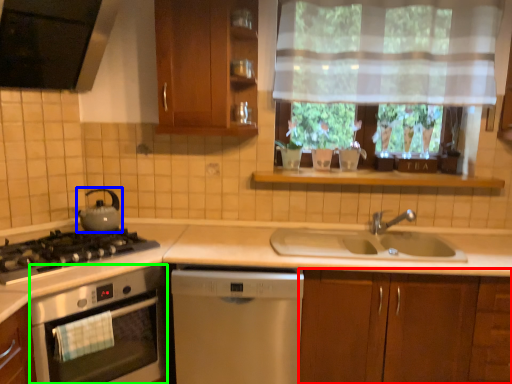
Question: Which is farther away from cabinetry (highlighted by a red box)? kitchen appliance (highlighted by a blue box) or kitchen appliance (highlighted by a green box)?

Choices:
 (A) kitchen appliance
 (B) kitchen appliance

Answer: (A)